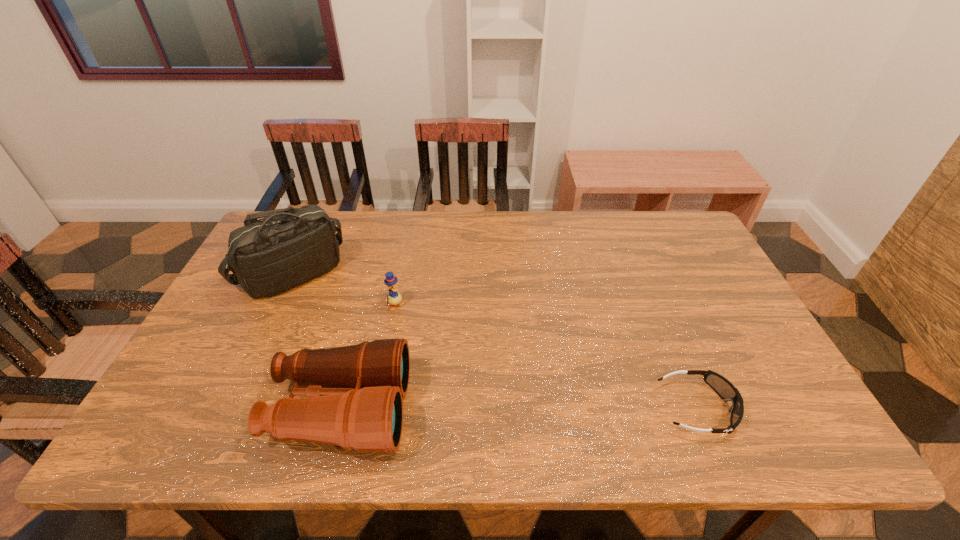
Locate an element on the screen. free point located 0.170m at the front padded panel of the tallest object is located at coordinates (364, 320).

Locate an element on the screen. vacant space located 0.300m at the front padded panel of the tallest object is located at coordinates (396, 343).

I want to click on object positioned at the far edge, so click(291, 246).

Locate an element on the screen. This screenshot has width=960, height=540. binoculars that is positioned at the near edge is located at coordinates (362, 409).

This screenshot has width=960, height=540. In order to click on goggles that is at the near edge in this screenshot , I will do `click(724, 388)`.

Image resolution: width=960 pixels, height=540 pixels. Identify the location of object that is at the left edge. (291, 246).

Where is `object that is positioned at the right edge`? The height and width of the screenshot is (540, 960). object that is positioned at the right edge is located at coordinates [724, 388].

Find the location of a particular element. The height and width of the screenshot is (540, 960). object located at the far left corner is located at coordinates (291, 246).

The height and width of the screenshot is (540, 960). What are the coordinates of `object that is at the near right corner` in the screenshot? It's located at (724, 388).

Locate an element on the screen. Image resolution: width=960 pixels, height=540 pixels. vacant space at the far edge is located at coordinates (414, 211).